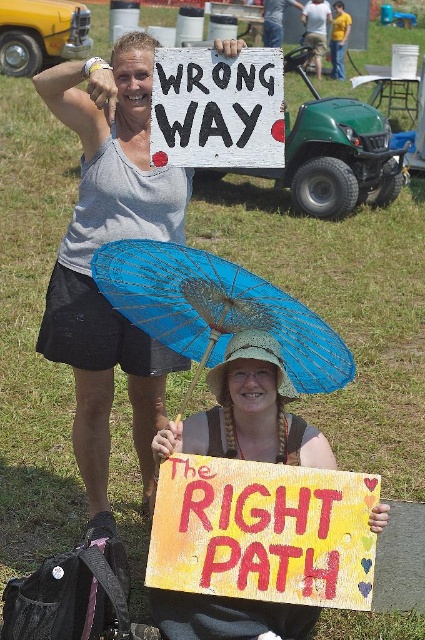
You are a hiker trying to decide which direction to take. You see a matte gray tank top at upper left and a blue paper parasol at lower center. Which object is higher in the image?

The matte gray tank top at upper left is taller than the blue paper parasol at lower center.

You are standing at the point with coordinates (263,531) in the image. What object are you standing on?

The point at (263,531) is on the yellow painted wood sign at lower center.